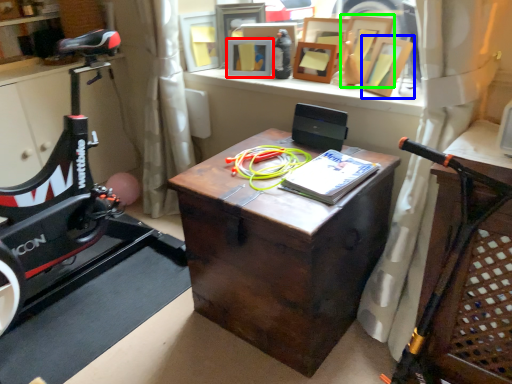
Question: Estimate the real-world distances between objects in this image. Which object is farther from picture frame (highlighted by a red box), picture frame (highlighted by a blue box) or picture frame (highlighted by a green box)?

Choices:
 (A) picture frame
 (B) picture frame

Answer: (A)